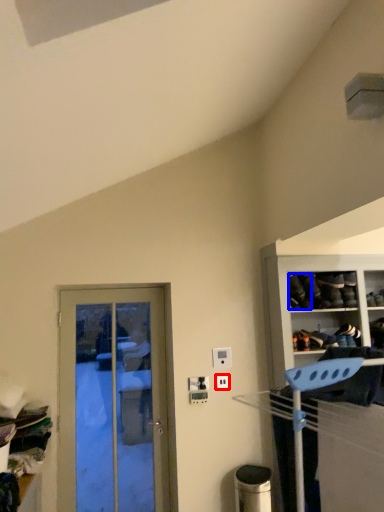
Question: Which point is closer to the camera, electric outlet (highlighted by a red box) or shoe (highlighted by a blue box)?

Choices:
 (A) electric outlet
 (B) shoe

Answer: (B)